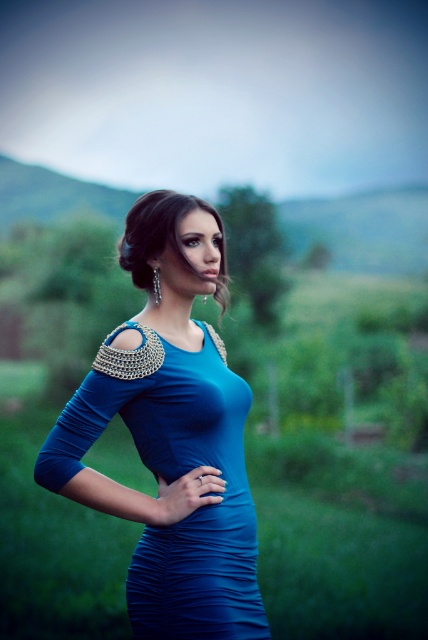
Question: Which object is the closest to the ruched satin dress at center?

Choices:
 (A) satin blue dress at center
 (B) matte blue dress at center

Answer: (B)

Question: Can you confirm if matte blue dress at center is positioned to the right of satin blue dress at center?

Choices:
 (A) no
 (B) yes

Answer: (A)

Question: Which of these objects is positioned farthest from the ruched satin dress at center?

Choices:
 (A) matte blue dress at center
 (B) satin blue dress at center

Answer: (B)

Question: Which of the following is the farthest from the observer?

Choices:
 (A) matte blue dress at center
 (B) ruched satin dress at center

Answer: (A)

Question: Does ruched satin dress at center have a greater width compared to satin blue dress at center?

Choices:
 (A) no
 (B) yes

Answer: (B)

Question: Is matte blue dress at center to the left of ruched satin dress at center from the viewer's perspective?

Choices:
 (A) no
 (B) yes

Answer: (B)